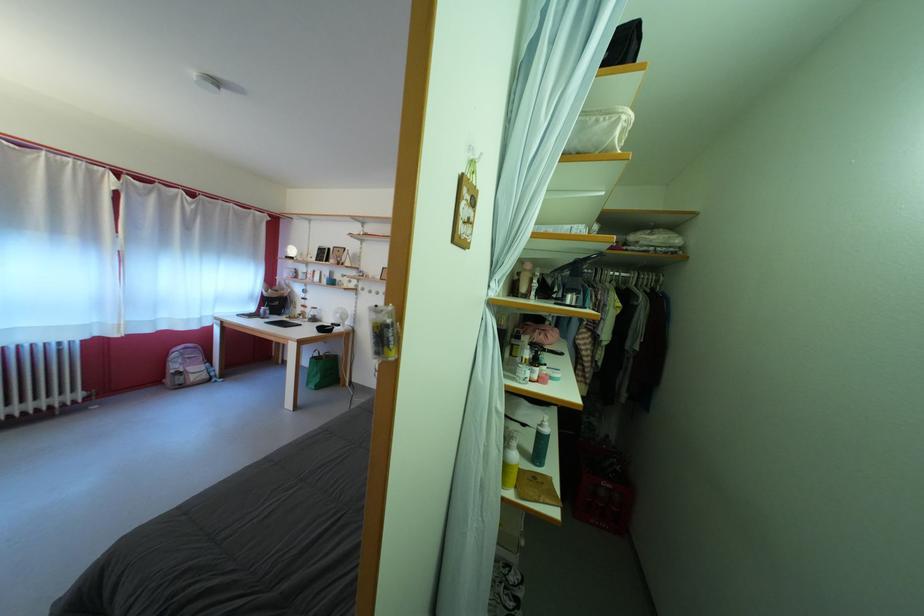
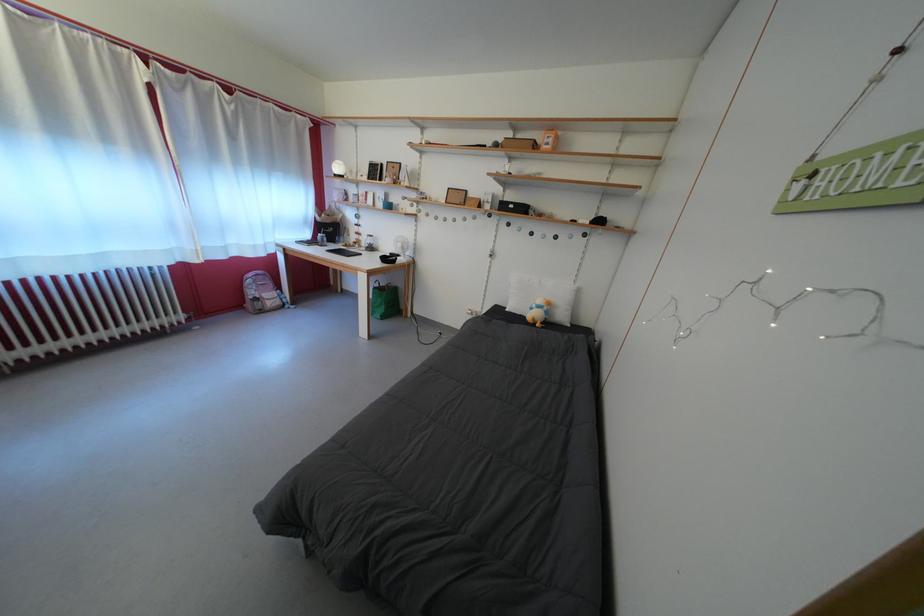
The images are taken continuously from a first-person perspective. In which direction are you moving?

The cameraman moved toward left, forward.